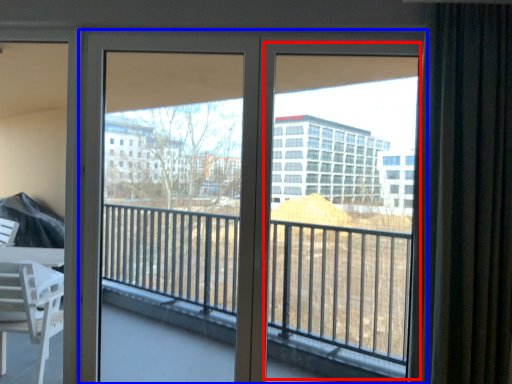
Question: Which of the following is the closest to the observer, window screen (highlighted by a red box) or door (highlighted by a blue box)?

Choices:
 (A) window screen
 (B) door

Answer: (A)